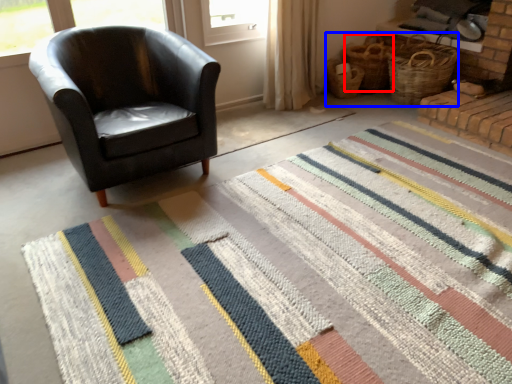
Question: Which object is further to the camera taking this photo, basket (highlighted by a red box) or basket (highlighted by a blue box)?

Choices:
 (A) basket
 (B) basket

Answer: (A)